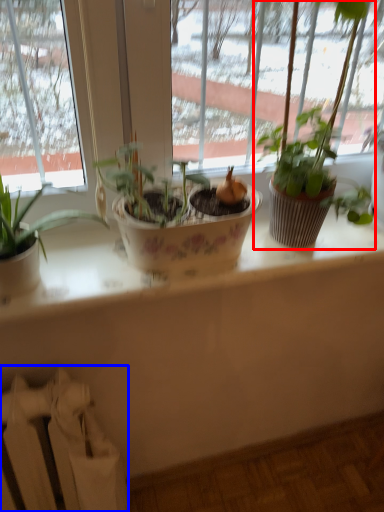
Question: Which object appears closest to the camera in this image, houseplant (highlighted by a red box) or radiator (highlighted by a blue box)?

Choices:
 (A) houseplant
 (B) radiator

Answer: (A)